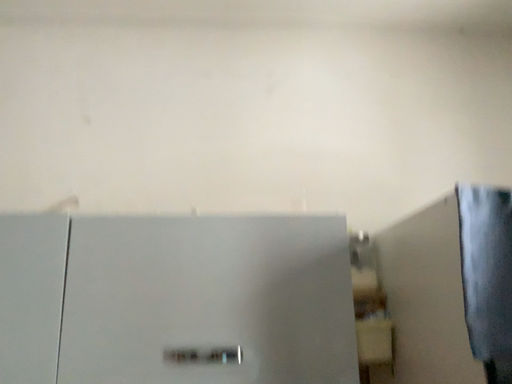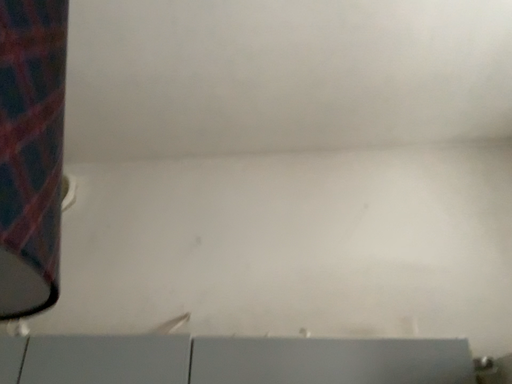
Question: How did the camera likely rotate when shooting the video?

Choices:
 (A) rotated left
 (B) rotated right

Answer: (A)